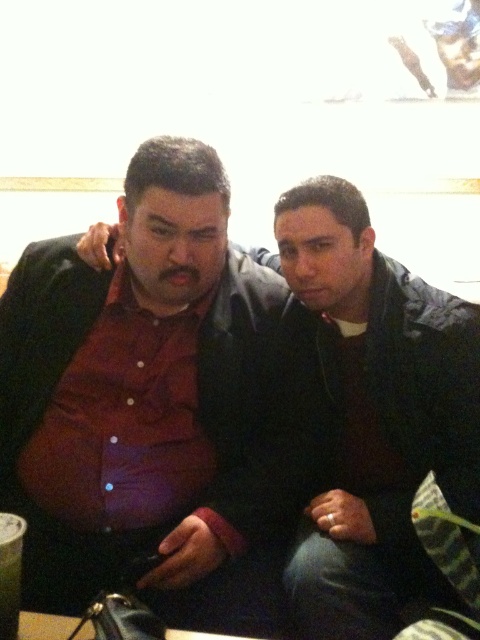
Is point (123, 400) behind point (400, 433)?

That is False.

Who is taller, matte black shirt at center or matte black jacket at center?

Standing taller between the two is matte black shirt at center.

Identify the location of matte black shirt at center. (148, 404).

What are the coordinates of `matte black shirt at center` in the screenshot? It's located at (148, 404).

Does matte black jacket at center have a greater width compared to clear plastic cup at lower left?

Yes.

The height and width of the screenshot is (640, 480). I want to click on matte black jacket at center, so click(375, 417).

Image resolution: width=480 pixels, height=640 pixels. What are the coordinates of `matte black jacket at center` in the screenshot? It's located at (375, 417).

Does matte black shirt at center come behind clear plastic cup at lower left?

Yes, matte black shirt at center is behind clear plastic cup at lower left.

Identify the location of matte black shirt at center. (148, 404).